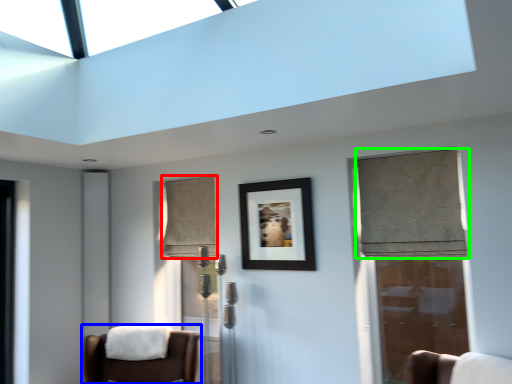
Question: Which object is positioned farthest from curtain (highlighted by a red box)? Select from chair (highlighted by a blue box) and curtain (highlighted by a green box).

Choices:
 (A) chair
 (B) curtain

Answer: (B)